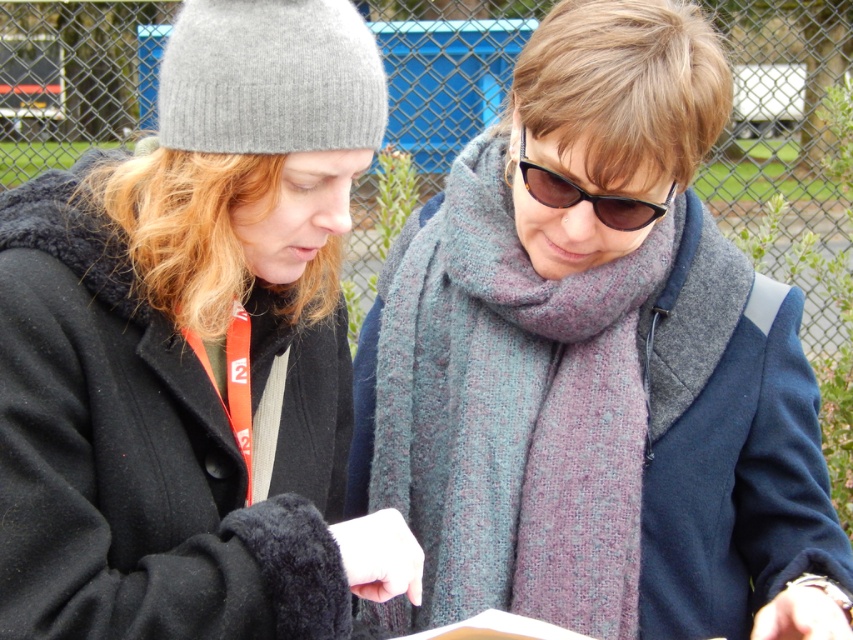
You are a photographer trying to capture a candid shot of the havana tortoiseshell sunglasses at center without the person noticing. The matte black coat at left is blocking your view. Can you move to the right to get a clear shot of the sunglasses?

The matte black coat at left is in front of the havana tortoiseshell sunglasses at center, so moving to the right might allow you to see around the coat and capture the sunglasses without being noticed.

You are a photographer trying to capture a clear shot of the knitted wool scarf at center. However, the matte black coat at left is blocking your view. Can you determine if the scarf is completely hidden by the coat?

The matte black coat at left is positioned over the knitted wool scarf at center, so the scarf is completely hidden by the coat.

You are a fashion designer observing two people in the image. You need to determine if the distance between the matte black coat at left and the knitted wool scarf at center is sufficient to place a 20 inch decorative ribbon between them. Can you confirm if there is enough space?

The matte black coat at left is 19.34 inches from the knitted wool scarf at center. Since the distance is less than 20 inches, the decorative ribbon would not fit between them.